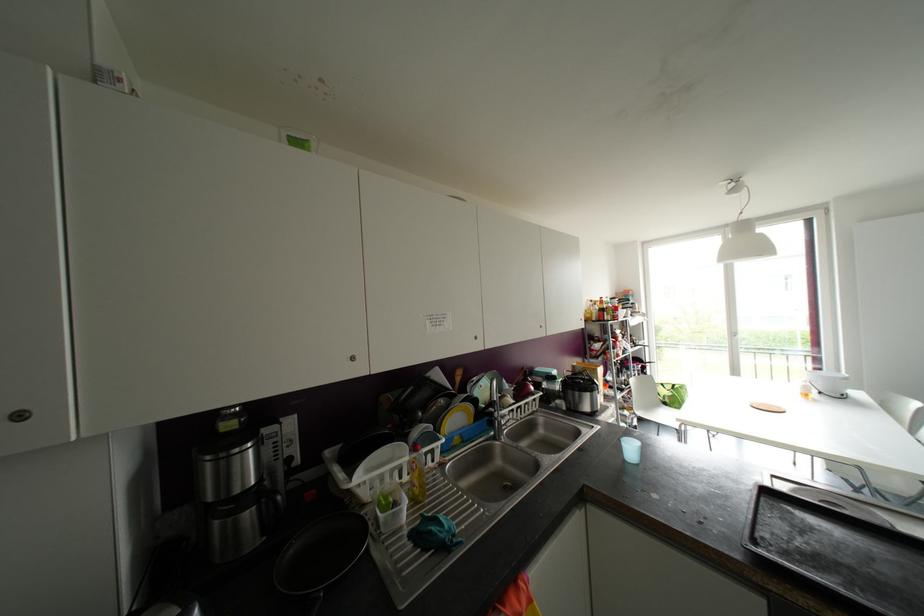
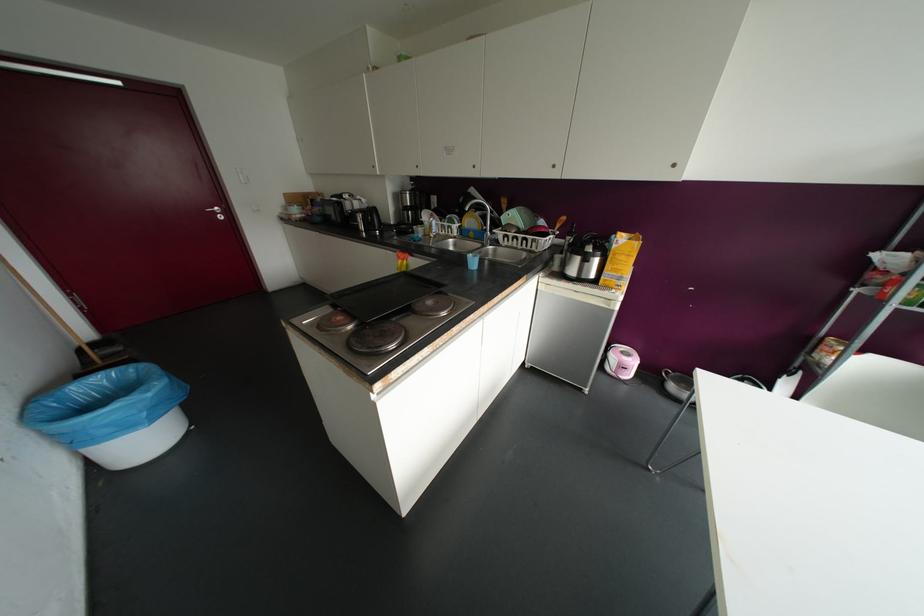
The point at (476, 338) is marked in the first image. Where is the corresponding point in the second image?

(473, 166)